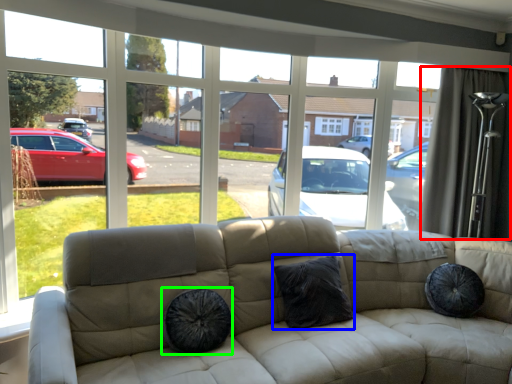
Question: Considering the real-world distances, which object is farthest from curtain (highlighted by a red box)? pillow (highlighted by a blue box) or dog bed (highlighted by a green box)?

Choices:
 (A) pillow
 (B) dog bed

Answer: (B)